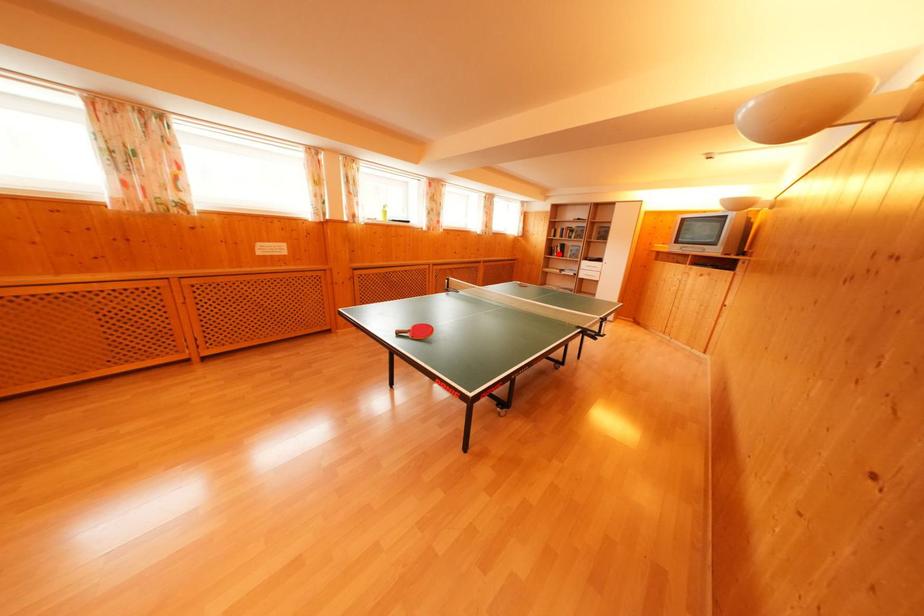
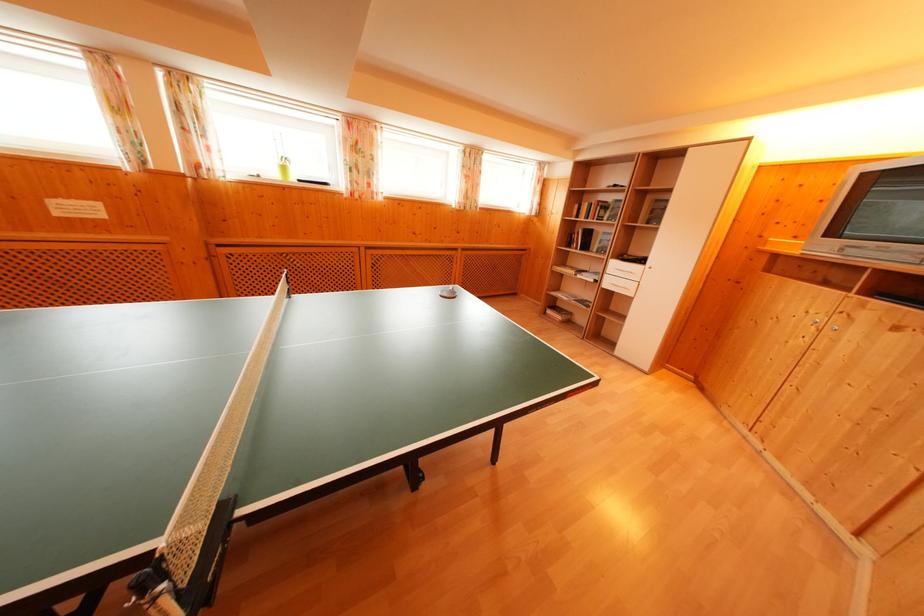
Question: I am providing you with two images of the same scene from different viewpoints. A red point is marked on the first image. At the location where the point appears in image 1, is it still visible in image 2?

Choices:
 (A) Yes
 (B) No

Answer: (A)